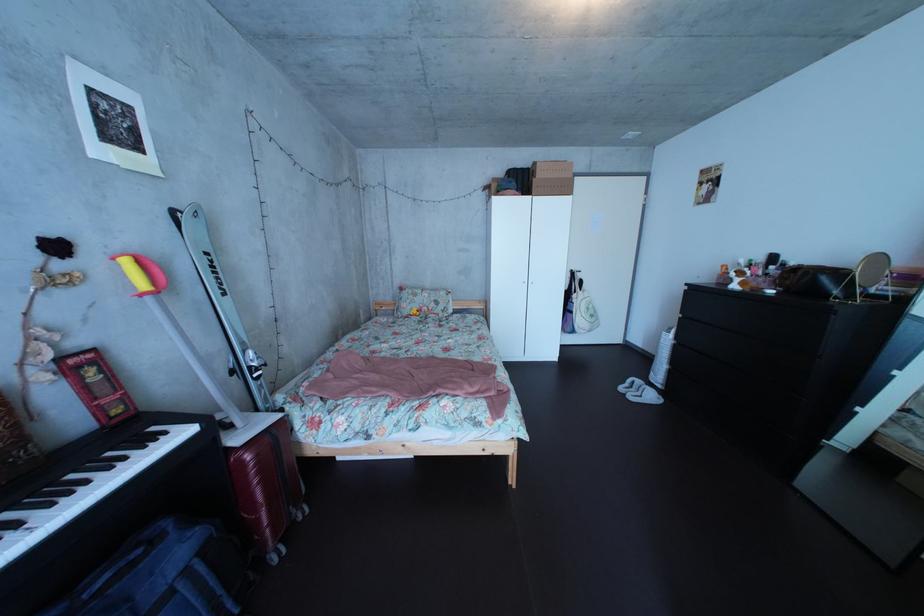
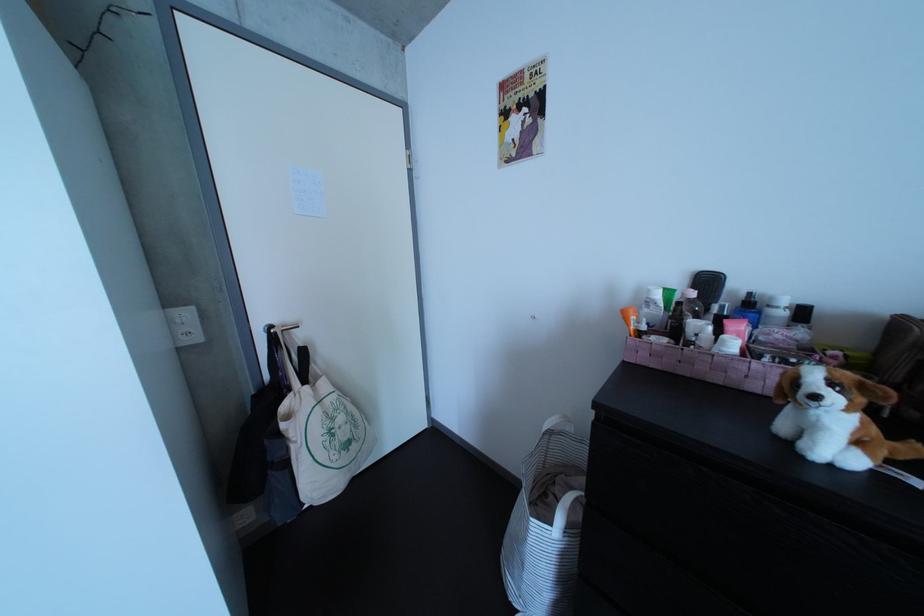
The point at (604, 314) is marked in the first image. Where is the corresponding point in the second image?

(355, 426)